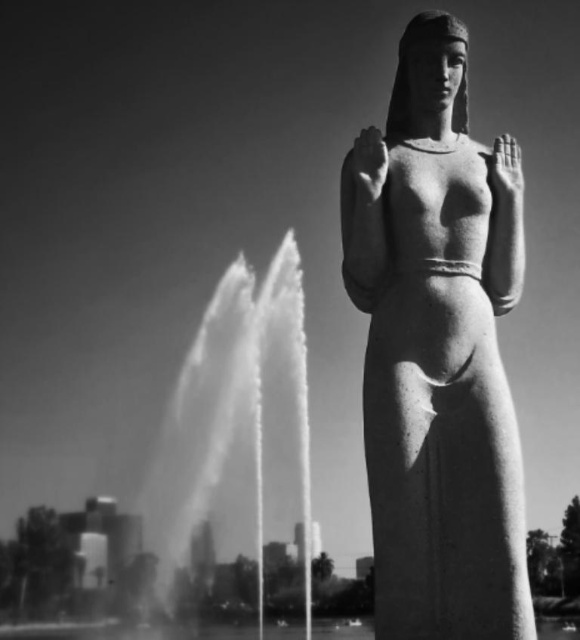
Question: Is smooth stone hand at upper center bigger than white matte hand at upper center?

Choices:
 (A) yes
 (B) no

Answer: (B)

Question: Which object is closer to the camera taking this photo?

Choices:
 (A) clear water at center
 (B) white matte hand at upper center

Answer: (A)

Question: Which of the following is the farthest from the observer?

Choices:
 (A) clear water at center
 (B) white matte hand at upper center

Answer: (B)

Question: Which of the following is the farthest from the observer?

Choices:
 (A) (447, 588)
 (B) (509, 180)

Answer: (B)

Question: Can you confirm if granite statue at center is smaller than smooth stone hand at upper center?

Choices:
 (A) yes
 (B) no

Answer: (B)

Question: Does clear water at center appear on the right side of white matte hand at upper center?

Choices:
 (A) no
 (B) yes

Answer: (A)